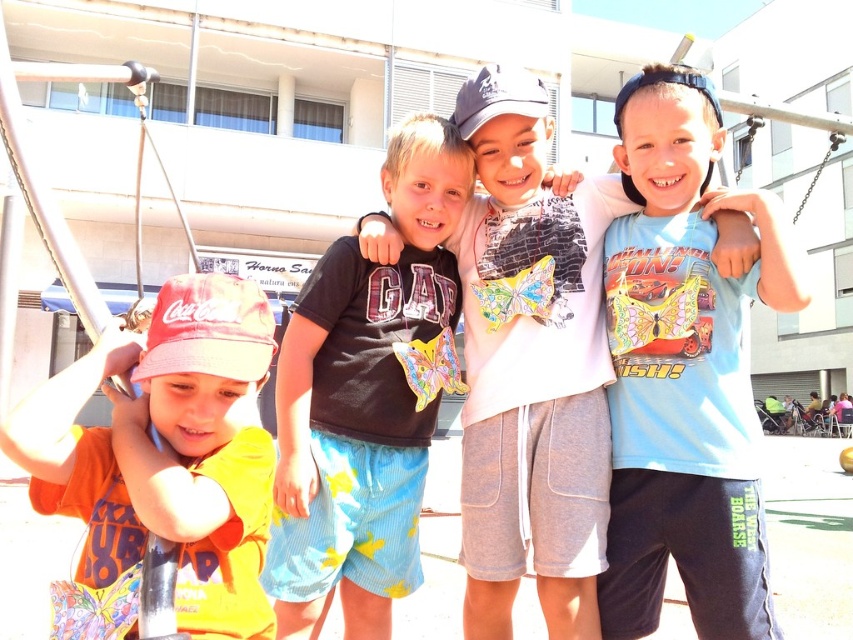
Question: Is light blue t-shirt at center behind matte black t-shirt at center?

Choices:
 (A) yes
 (B) no

Answer: (A)

Question: Estimate the real-world distances between objects in this image. Which object is closer to the light blue t-shirt at center?

Choices:
 (A) matte black t-shirt at center
 (B) light blue cotton shirt at center
 (C) orange cotton shirt at left

Answer: (B)

Question: Can you confirm if matte black t-shirt at center is bigger than orange cotton shirt at left?

Choices:
 (A) yes
 (B) no

Answer: (A)

Question: In this image, where is light blue t-shirt at center located relative to orange cotton shirt at left?

Choices:
 (A) above
 (B) below

Answer: (A)

Question: Estimate the real-world distances between objects in this image. Which object is farther from the light blue cotton shirt at center?

Choices:
 (A) orange cotton shirt at left
 (B) matte black t-shirt at center
 (C) light blue t-shirt at center

Answer: (A)

Question: Which of the following is the closest to the observer?

Choices:
 (A) orange cotton shirt at left
 (B) light blue cotton shirt at center
 (C) light blue t-shirt at center

Answer: (A)